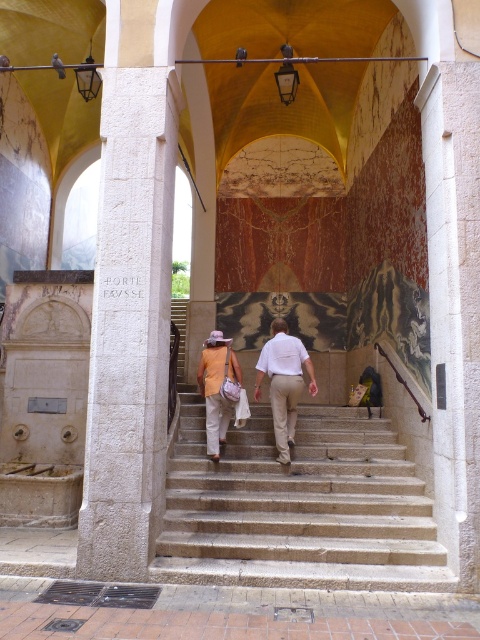
Question: Which object is positioned farthest from the matte orange shirt at center?

Choices:
 (A) white cotton shirt at center
 (B) stone stairs at center

Answer: (B)

Question: Which point is closer to the camera?

Choices:
 (A) matte orange shirt at center
 (B) stone stairs at center
 (C) white cotton shirt at center

Answer: (B)

Question: Does stone stairs at center have a lesser width compared to white cotton shirt at center?

Choices:
 (A) yes
 (B) no

Answer: (B)

Question: Is white cotton shirt at center smaller than matte orange shirt at center?

Choices:
 (A) yes
 (B) no

Answer: (B)

Question: Which object appears farthest from the camera in this image?

Choices:
 (A) stone stairs at center
 (B) matte orange shirt at center
 (C) white cotton shirt at center

Answer: (B)

Question: Does stone stairs at center lie behind matte orange shirt at center?

Choices:
 (A) no
 (B) yes

Answer: (A)